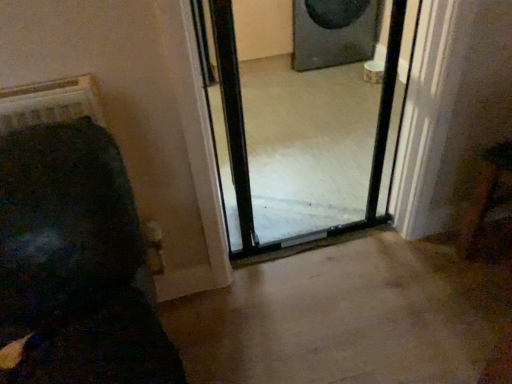
Question: Is black matte speaker at upper center not within clear glass screen door at center?

Choices:
 (A) no
 (B) yes

Answer: (B)

Question: From the image's perspective, is black matte speaker at upper center over clear glass screen door at center?

Choices:
 (A) yes
 (B) no

Answer: (A)

Question: Is black matte speaker at upper center at the left side of clear glass screen door at center?

Choices:
 (A) yes
 (B) no

Answer: (B)

Question: From a real-world perspective, is black matte speaker at upper center on clear glass screen door at center?

Choices:
 (A) yes
 (B) no

Answer: (B)

Question: Considering the relative sizes of black matte speaker at upper center and clear glass screen door at center in the image provided, is black matte speaker at upper center taller than clear glass screen door at center?

Choices:
 (A) yes
 (B) no

Answer: (B)

Question: Is clear glass screen door at center located within black matte speaker at upper center?

Choices:
 (A) no
 (B) yes

Answer: (A)

Question: Is clear glass screen door at center not inside black matte speaker at upper center?

Choices:
 (A) no
 (B) yes

Answer: (B)

Question: Is clear glass screen door at center thinner than black matte speaker at upper center?

Choices:
 (A) no
 (B) yes

Answer: (B)

Question: Does clear glass screen door at center have a greater width compared to black matte speaker at upper center?

Choices:
 (A) no
 (B) yes

Answer: (A)

Question: Is clear glass screen door at center positioned in front of black matte speaker at upper center?

Choices:
 (A) no
 (B) yes

Answer: (B)

Question: Is clear glass screen door at center facing away from black matte speaker at upper center?

Choices:
 (A) yes
 (B) no

Answer: (B)

Question: From the image's perspective, does clear glass screen door at center appear higher than black matte speaker at upper center?

Choices:
 (A) no
 (B) yes

Answer: (A)

Question: Is black matte speaker at upper center spatially inside clear glass screen door at center, or outside of it?

Choices:
 (A) outside
 (B) inside

Answer: (A)